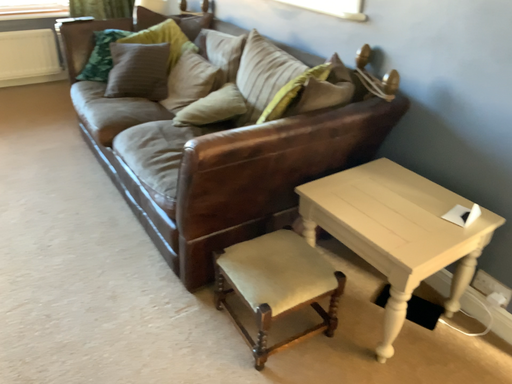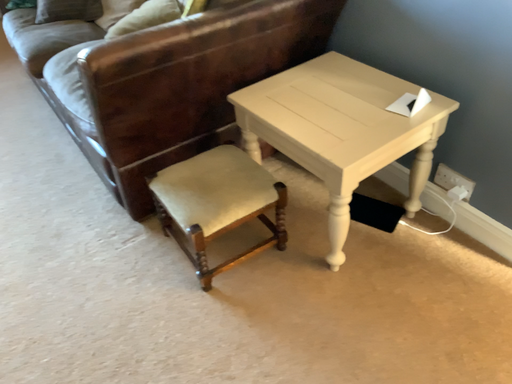
Question: How did the camera likely rotate when shooting the video?

Choices:
 (A) rotated upward
 (B) rotated downward

Answer: (B)